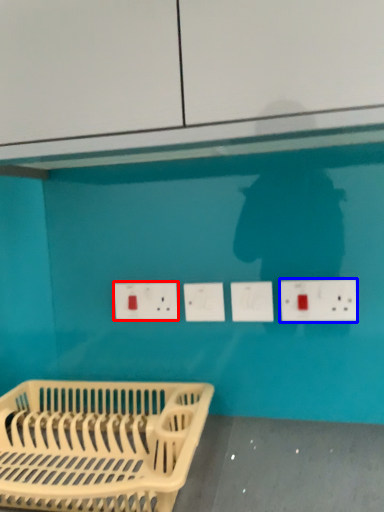
Question: Which object is closer to the camera taking this photo, electric outlet (highlighted by a red box) or electric outlet (highlighted by a blue box)?

Choices:
 (A) electric outlet
 (B) electric outlet

Answer: (B)